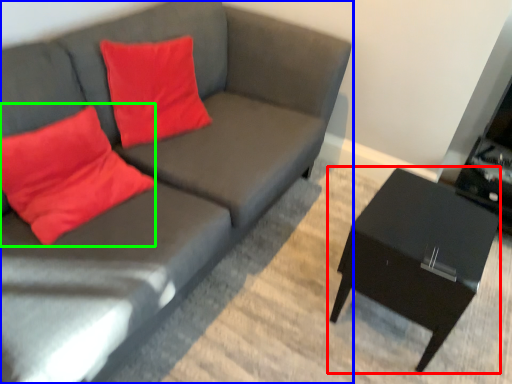
Question: Based on their relative distances, which object is farther from table (highlighted by a red box)? Choose from studio couch (highlighted by a blue box) and throw pillow (highlighted by a green box).

Choices:
 (A) studio couch
 (B) throw pillow

Answer: (B)